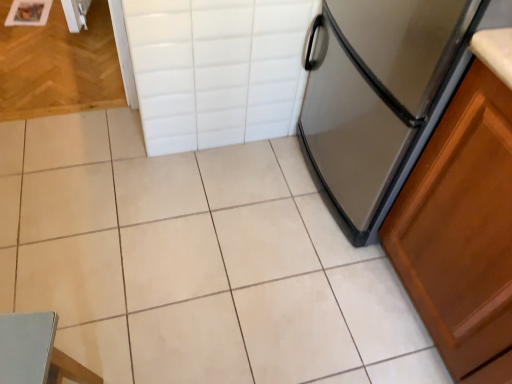
Question: Is white ceramic tile at center oriented away from white tile drawer at upper center?

Choices:
 (A) yes
 (B) no

Answer: (B)

Question: Is white ceramic tile at center further to the viewer compared to white tile drawer at upper center?

Choices:
 (A) yes
 (B) no

Answer: (B)

Question: From a real-world perspective, does white ceramic tile at center sit lower than white tile drawer at upper center?

Choices:
 (A) yes
 (B) no

Answer: (A)

Question: Is white ceramic tile at center bigger than white tile drawer at upper center?

Choices:
 (A) yes
 (B) no

Answer: (A)

Question: Can you confirm if white ceramic tile at center is shorter than white tile drawer at upper center?

Choices:
 (A) yes
 (B) no

Answer: (A)

Question: From the image's perspective, would you say white ceramic tile at center is shown under white tile drawer at upper center?

Choices:
 (A) yes
 (B) no

Answer: (A)

Question: Is white ceramic tile at center inside light blue fabric chair at lower left?

Choices:
 (A) yes
 (B) no

Answer: (B)

Question: Does light blue fabric chair at lower left have a smaller size compared to white ceramic tile at center?

Choices:
 (A) yes
 (B) no

Answer: (A)

Question: Is light blue fabric chair at lower left positioned far away from white ceramic tile at center?

Choices:
 (A) no
 (B) yes

Answer: (A)

Question: Considering the relative positions of light blue fabric chair at lower left and white ceramic tile at center in the image provided, is light blue fabric chair at lower left to the right of white ceramic tile at center from the viewer's perspective?

Choices:
 (A) yes
 (B) no

Answer: (B)

Question: Can you see light blue fabric chair at lower left touching white ceramic tile at center?

Choices:
 (A) no
 (B) yes

Answer: (A)

Question: From the image's perspective, is light blue fabric chair at lower left located beneath white ceramic tile at center?

Choices:
 (A) no
 (B) yes

Answer: (B)

Question: Is satin silver refrigerator at right facing towards white ceramic tile at center?

Choices:
 (A) no
 (B) yes

Answer: (B)